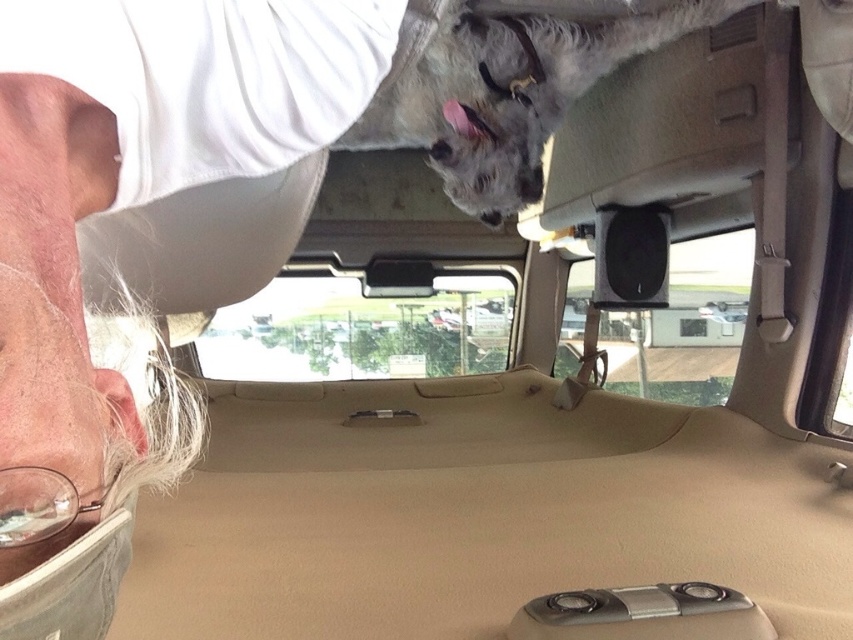
Who is more distant from viewer, (10, 419) or (590, 83)?

The point (590, 83) is behind.

Describe the element at coordinates (140, 246) in the screenshot. I see `gray fabric cap at upper left` at that location.

Does point (119, 81) come farther from viewer compared to point (456, 99)?

No, (119, 81) is closer to viewer.

I want to click on gray fabric cap at upper left, so click(x=140, y=246).

Can you confirm if gray fabric cap at upper left is positioned to the right of transparent glass car window at center?

Indeed, gray fabric cap at upper left is positioned on the right side of transparent glass car window at center.

Consider the image. Who is higher up, gray fabric cap at upper left or transparent glass car window at center?

Positioned higher is gray fabric cap at upper left.

What are the coordinates of `gray fabric cap at upper left` in the screenshot? It's located at (140, 246).

Does white fluffy dog at upper center appear under transparent glass car window at center?

Actually, white fluffy dog at upper center is above transparent glass car window at center.

Which of these two, white fluffy dog at upper center or transparent glass car window at center, stands taller?

With more height is transparent glass car window at center.

Which is in front, point (399, 38) or point (438, 371)?

Point (399, 38) is more forward.

Locate an element on the screen. Image resolution: width=853 pixels, height=640 pixels. white fluffy dog at upper center is located at coordinates (505, 93).